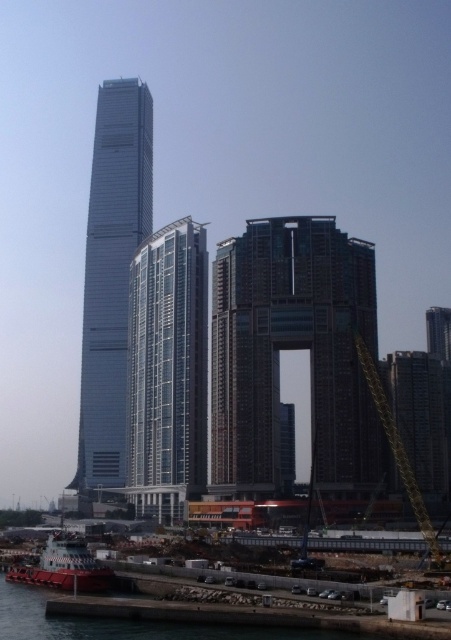
Question: Does brown textured building at center have a greater width compared to metallic red boat at lower left?

Choices:
 (A) yes
 (B) no

Answer: (A)

Question: Is smooth glass skyscraper at center smaller than metallic red boat at lower left?

Choices:
 (A) yes
 (B) no

Answer: (B)

Question: Which point is farther from the camera taking this photo?

Choices:
 (A) (404, 465)
 (B) (151, 472)
 (C) (92, 582)

Answer: (B)

Question: Is smooth glass skyscraper at center further to camera compared to yellow metallic crane at lower right?

Choices:
 (A) no
 (B) yes

Answer: (B)

Question: Which point is closer to the camera?

Choices:
 (A) (295, 243)
 (B) (165, 298)
 (C) (368, 380)
 (D) (86, 572)

Answer: (D)

Question: Which of the following is the farthest from the observer?

Choices:
 (A) yellow metallic crane at lower right
 (B) metallic red boat at lower left
 (C) smooth glass skyscraper at center

Answer: (C)